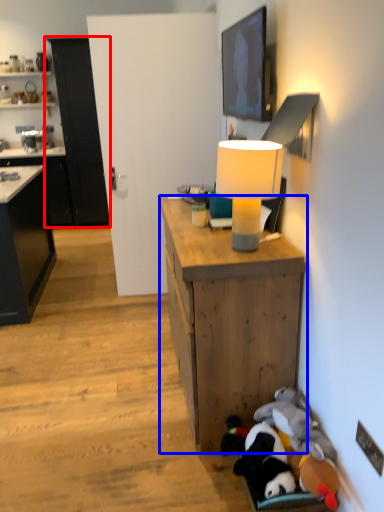
Question: Which object appears farthest to the camera in this image, cabinetry (highlighted by a red box) or desk (highlighted by a blue box)?

Choices:
 (A) cabinetry
 (B) desk

Answer: (A)